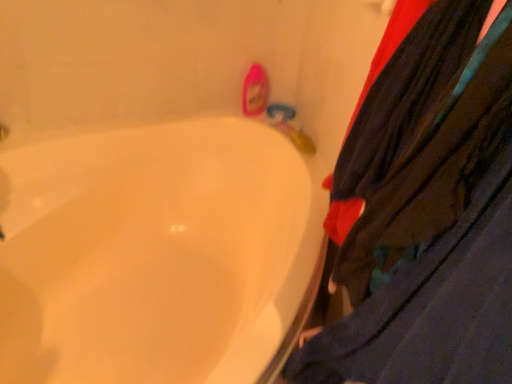
Question: Considering the relative sizes of white glossy bathtub at lower left and velvet-like dark blue pants at right in the image provided, is white glossy bathtub at lower left bigger than velvet-like dark blue pants at right?

Choices:
 (A) yes
 (B) no

Answer: (A)

Question: Is velvet-like dark blue pants at right inside white glossy bathtub at lower left?

Choices:
 (A) no
 (B) yes

Answer: (A)

Question: Is white glossy bathtub at lower left thinner than velvet-like dark blue pants at right?

Choices:
 (A) no
 (B) yes

Answer: (A)

Question: Is white glossy bathtub at lower left located outside velvet-like dark blue pants at right?

Choices:
 (A) no
 (B) yes

Answer: (B)

Question: Could you tell me if white glossy bathtub at lower left is turned towards velvet-like dark blue pants at right?

Choices:
 (A) yes
 (B) no

Answer: (B)

Question: Is the depth of white glossy bathtub at lower left less than that of velvet-like dark blue pants at right?

Choices:
 (A) yes
 (B) no

Answer: (B)

Question: Can you confirm if velvet-like dark blue pants at right is wider than white glossy bathtub at lower left?

Choices:
 (A) yes
 (B) no

Answer: (B)

Question: From a real-world perspective, is velvet-like dark blue pants at right under white glossy bathtub at lower left?

Choices:
 (A) no
 (B) yes

Answer: (A)

Question: From the image's perspective, is velvet-like dark blue pants at right located beneath white glossy bathtub at lower left?

Choices:
 (A) yes
 (B) no

Answer: (B)

Question: Is velvet-like dark blue pants at right to the right of white glossy bathtub at lower left from the viewer's perspective?

Choices:
 (A) yes
 (B) no

Answer: (A)

Question: From the image's perspective, does velvet-like dark blue pants at right appear higher than white glossy bathtub at lower left?

Choices:
 (A) no
 (B) yes

Answer: (B)

Question: Is velvet-like dark blue pants at right at the left side of white glossy bathtub at lower left?

Choices:
 (A) no
 (B) yes

Answer: (A)

Question: In the image, is white glossy bathtub at lower left positioned in front of or behind velvet-like dark blue pants at right?

Choices:
 (A) front
 (B) behind

Answer: (B)